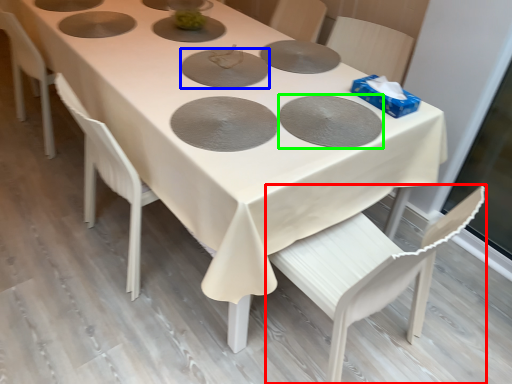
Question: Which is farther away from chair (highlighted by a red box)? pizza pan (highlighted by a blue box) or pizza pan (highlighted by a green box)?

Choices:
 (A) pizza pan
 (B) pizza pan

Answer: (A)